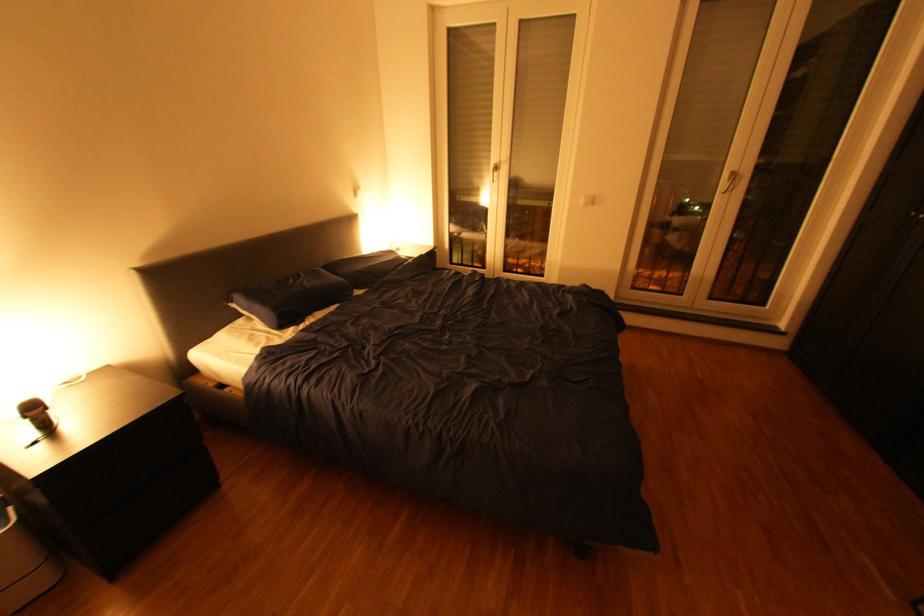
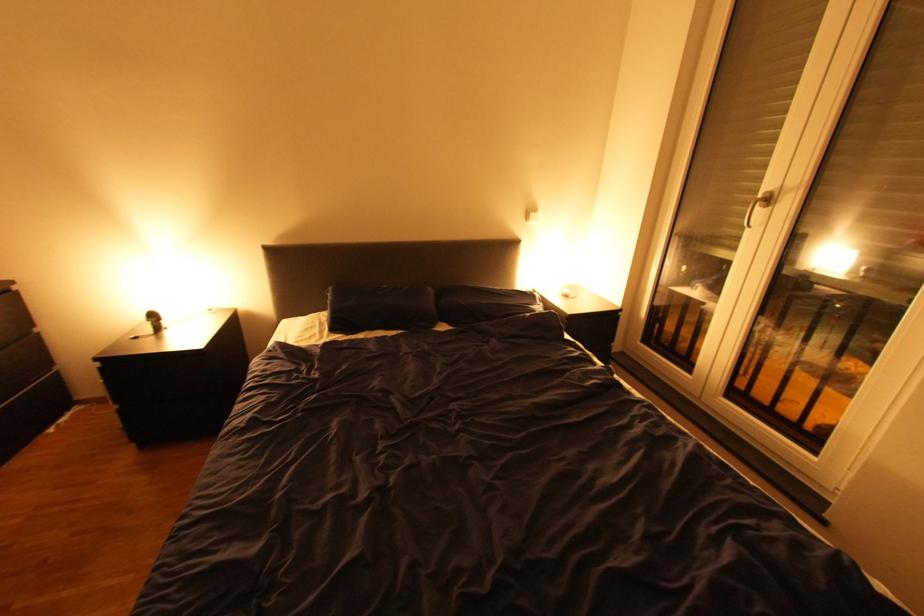
Find the pixel in the second image that matches [499,164] in the first image.

(767, 192)